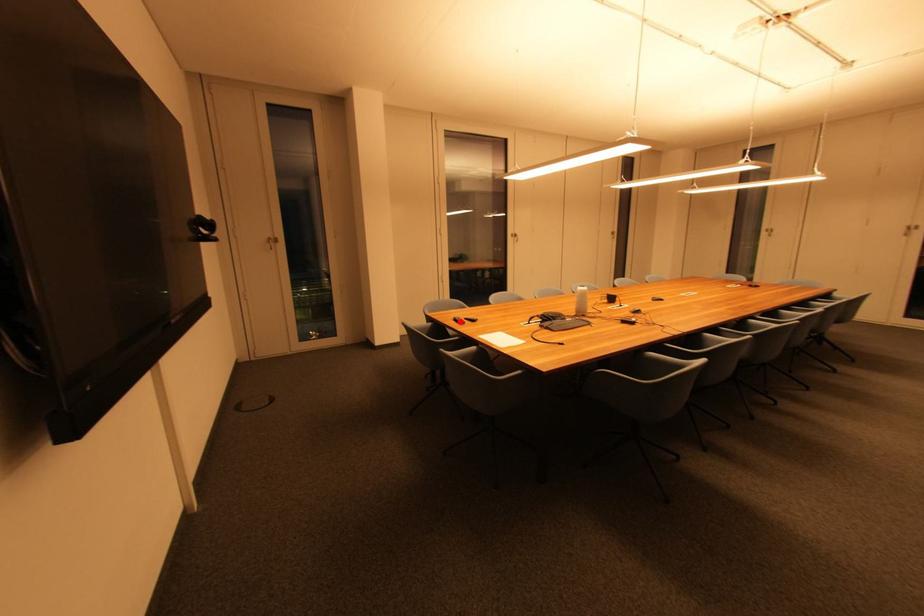
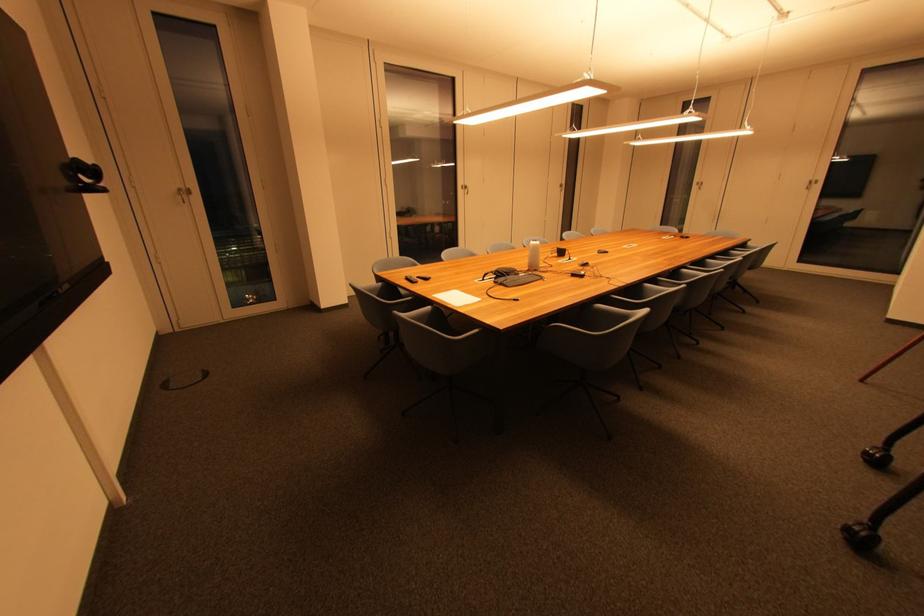
In the second image, find the point that corresponds to the highlighted location in the first image.

(411, 281)